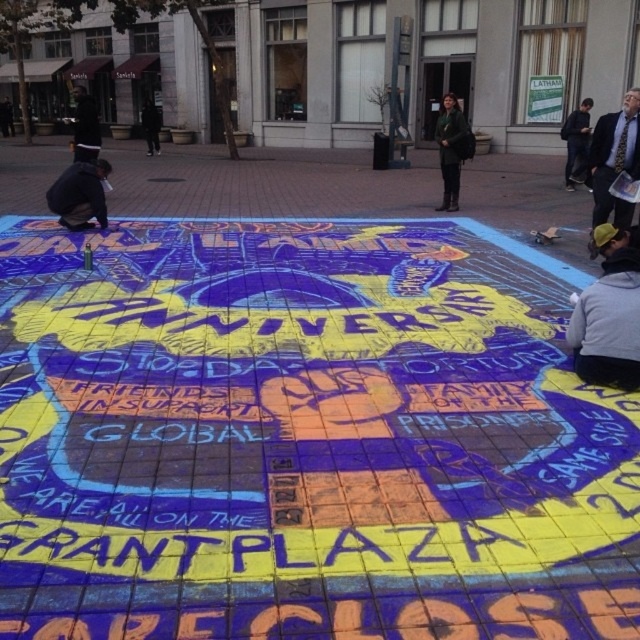
You are a photographer trying to capture both the light blue shirt at upper right and the dark green jacket at center in a single frame. Based on their heights, which object should you focus on to ensure both are in the frame without cropping?

The light blue shirt at upper right is not as tall as the dark green jacket at center, so you should focus on the dark green jacket at center to ensure both are in the frame without cropping.

You are a photographer standing in front of the chalk mural at Grant Plaza. You notice two people in the scene wearing a gray sweatshirt at lower right and a light blue shirt at upper right. Which clothing item is larger in size?

The gray sweatshirt at lower right is bigger than the light blue shirt at upper right.